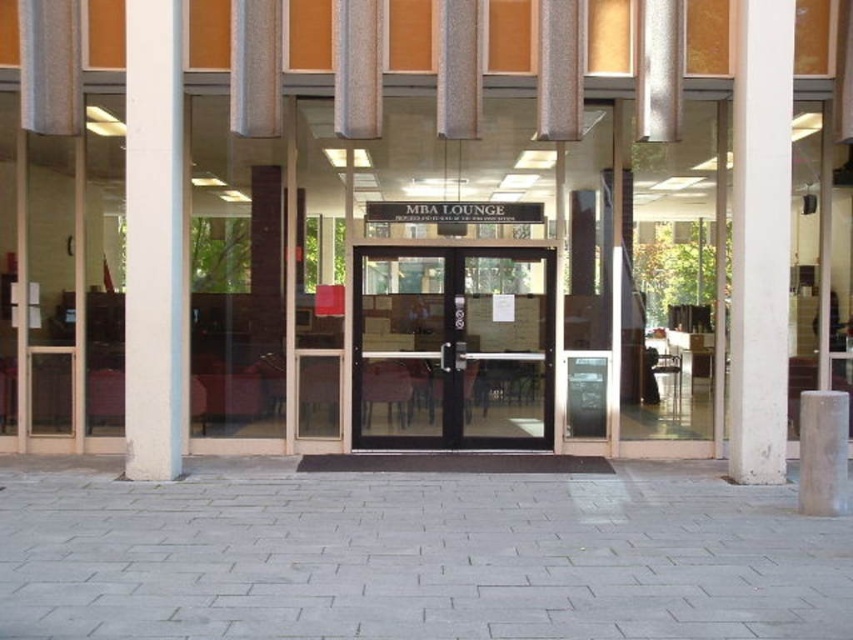
Between white concrete pillar at right and white concrete pillar at left, which one is positioned higher?

Positioned higher is white concrete pillar at right.

Does white concrete pillar at right appear on the right side of white concrete pillar at left?

Yes, white concrete pillar at right is to the right of white concrete pillar at left.

Image resolution: width=853 pixels, height=640 pixels. In order to click on white concrete pillar at right in this screenshot , I will do `click(759, 240)`.

I want to click on white concrete pillar at right, so click(x=759, y=240).

Which of these two, transparent glass door at center or white concrete pillar at right, stands shorter?

Standing shorter between the two is transparent glass door at center.

Does transparent glass door at center appear on the right side of white concrete pillar at right?

Incorrect, transparent glass door at center is not on the right side of white concrete pillar at right.

This screenshot has height=640, width=853. Identify the location of transparent glass door at center. (451, 348).

At what (x,y) coordinates should I click in order to perform the action: click on transparent glass door at center. Please return your answer as a coordinate pair (x, y). Looking at the image, I should click on (451, 348).

Between transparent glass door at center and white concrete pillar at left, which one has more height?

white concrete pillar at left is taller.

Is point (461, 292) in front of point (173, 404)?

That is False.

Measure the distance between point (496, 401) and camera.

Point (496, 401) is 32.12 feet from camera.

Find the location of a particular element. transparent glass door at center is located at coordinates (451, 348).